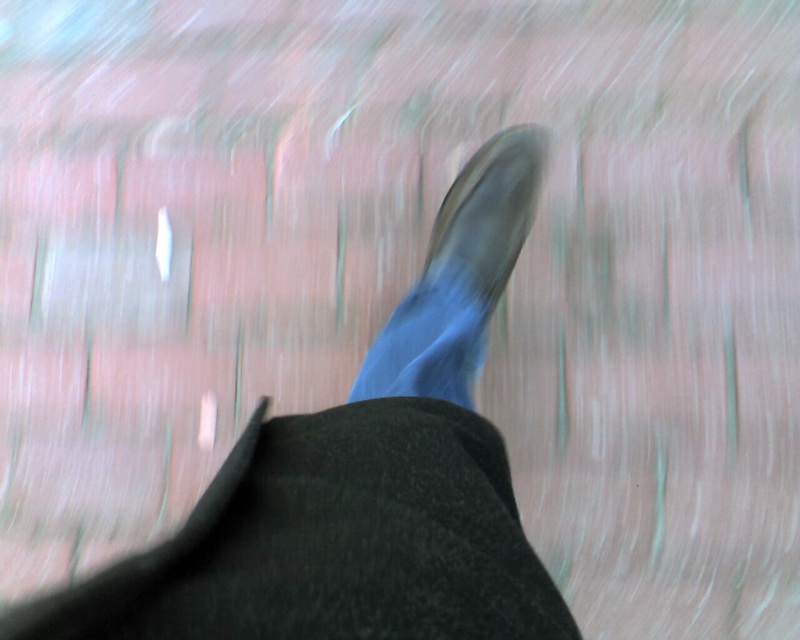
What do you see at coordinates (360, 481) in the screenshot? I see `shiny black shoe at center` at bounding box center [360, 481].

At what (x,y) coordinates should I click in order to perform the action: click on shiny black shoe at center. Please return your answer as a coordinate pair (x, y). Looking at the image, I should click on (360, 481).